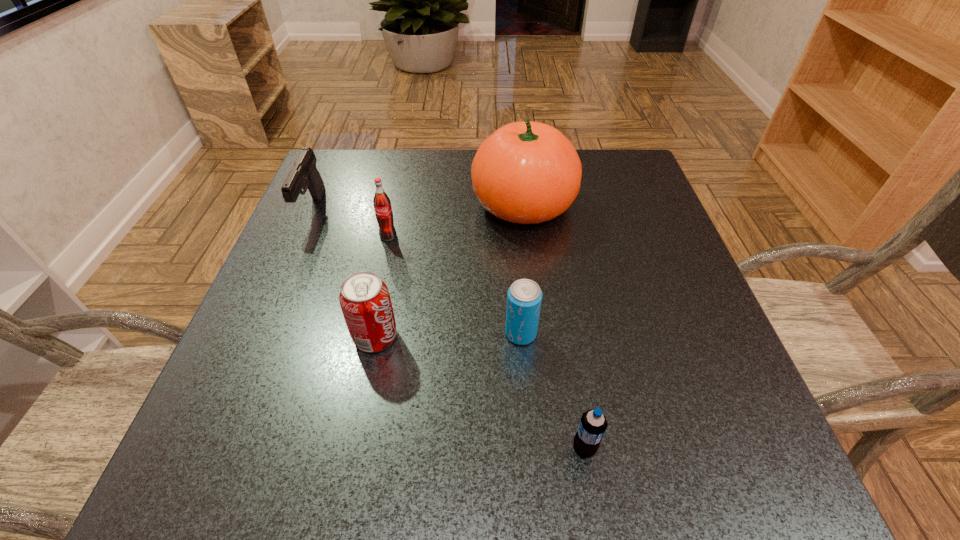
Locate an element on the screen. This screenshot has height=540, width=960. free spot located on the back of the rightmost soda bottle is located at coordinates (563, 321).

At what (x,y) coordinates should I click in order to perform the action: click on pumpkin situated at the far edge. Please return your answer as a coordinate pair (x, y). Looking at the image, I should click on (526, 172).

You are a GUI agent. You are given a task and a screenshot of the screen. Output one action in this format:
    pyautogui.click(x=<x>, y=<y>)
    Task: Click on the pistol at the far edge
    
    Given the screenshot: What is the action you would take?
    pyautogui.click(x=304, y=174)

Find the location of a particular element. The height and width of the screenshot is (540, 960). object at the near edge is located at coordinates (592, 426).

Find the location of a particular element. Image resolution: width=960 pixels, height=540 pixels. object situated at the left edge is located at coordinates (304, 174).

This screenshot has width=960, height=540. I want to click on object situated at the far left corner, so click(x=304, y=174).

You are a GUI agent. You are given a task and a screenshot of the screen. Output one action in this format:
    pyautogui.click(x=<x>, y=<y>)
    Task: Click on the vacant space at the far edge of the desktop
    
    Given the screenshot: What is the action you would take?
    pyautogui.click(x=454, y=169)

Locate an element on the screen. The image size is (960, 540). vacant space at the near edge of the desktop is located at coordinates (500, 446).

This screenshot has height=540, width=960. Find the location of `free space at the left edge of the desktop`. free space at the left edge of the desktop is located at coordinates (359, 250).

In the image, there is a desktop. In order to click on free space at the right edge in this screenshot , I will do `click(635, 208)`.